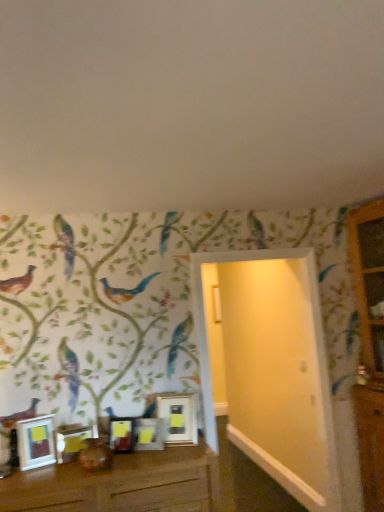
Locate an element on the screen. The width and height of the screenshot is (384, 512). empty space that is ontop of brown wooden table at lower center is located at coordinates (110, 464).